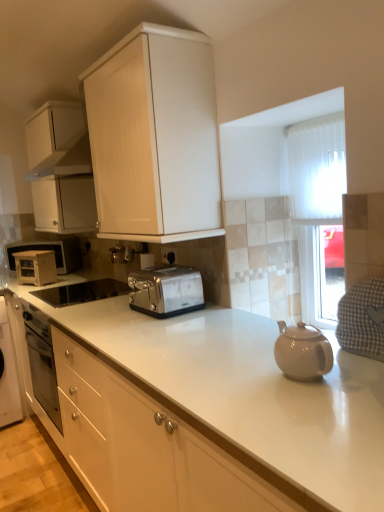
Question: Are white matte microwave at left, which appears as the third appliance when viewed from the front, and gray checkered cloth at right making contact?

Choices:
 (A) no
 (B) yes

Answer: (A)

Question: Is white matte microwave at left, the 1th appliance positioned from the back, surrounding gray checkered cloth at right?

Choices:
 (A) yes
 (B) no

Answer: (B)

Question: Does white matte microwave at left, which appears as the third appliance when viewed from the front, have a greater height compared to gray checkered cloth at right?

Choices:
 (A) yes
 (B) no

Answer: (A)

Question: Is white matte microwave at left, which appears as the third appliance when viewed from the front, further to the viewer compared to gray checkered cloth at right?

Choices:
 (A) no
 (B) yes

Answer: (B)

Question: From a real-world perspective, is white matte microwave at left, which appears as the third appliance when viewed from the front, on top of gray checkered cloth at right?

Choices:
 (A) no
 (B) yes

Answer: (B)

Question: Considering the positions of gray checkered cloth at right and satin silver toaster at left, which is counted as the second appliance, starting from the front, in the image, is gray checkered cloth at right bigger or smaller than satin silver toaster at left, which is counted as the second appliance, starting from the front,?

Choices:
 (A) big
 (B) small

Answer: (B)

Question: From their relative heights in the image, would you say gray checkered cloth at right is taller or shorter than satin silver toaster at left, which is counted as the second appliance, starting from the front?

Choices:
 (A) short
 (B) tall

Answer: (B)

Question: From a real-world perspective, relative to satin silver toaster at left, which ranks as the second appliance in back-to-front order, is gray checkered cloth at right vertically above or below?

Choices:
 (A) below
 (B) above

Answer: (B)

Question: In the image, is gray checkered cloth at right positioned in front of or behind satin silver toaster at left, which is counted as the second appliance, starting from the front?

Choices:
 (A) behind
 (B) front

Answer: (B)

Question: In the image, is white glossy cabinet at upper center, positioned as the 1th cabinetry in front-to-back order, positioned in front of or behind satin silver toaster at center, acting as the 3th appliance starting from the back?

Choices:
 (A) front
 (B) behind

Answer: (A)

Question: In terms of width, does white glossy cabinet at upper center, positioned as the 2th cabinetry in back-to-front order, look wider or thinner when compared to satin silver toaster at center, which ranks as the 1th appliance in front-to-back order?

Choices:
 (A) thin
 (B) wide

Answer: (A)

Question: From their relative heights in the image, would you say white glossy cabinet at upper center, acting as the first cabinetry starting from the right, is taller or shorter than satin silver toaster at center, acting as the 3th appliance starting from the back?

Choices:
 (A) short
 (B) tall

Answer: (B)

Question: Does point (130, 140) appear closer or farther from the camera than point (74, 291)?

Choices:
 (A) closer
 (B) farther

Answer: (A)

Question: Would you say white glossy cabinet at upper center, acting as the first cabinetry starting from the right, is to the left or to the right of gray checkered cloth at right in the picture?

Choices:
 (A) right
 (B) left

Answer: (B)

Question: In terms of width, does white glossy cabinet at upper center, acting as the first cabinetry starting from the right, look wider or thinner when compared to gray checkered cloth at right?

Choices:
 (A) thin
 (B) wide

Answer: (B)